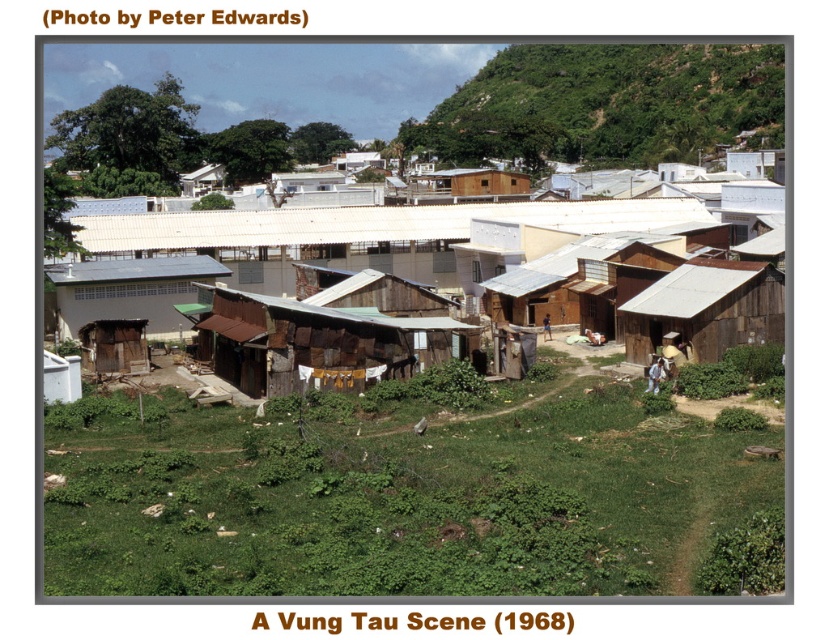
Does weathered wood hut at center-right appear on the right side of brown corrugated metal hut at lower left?

Indeed, weathered wood hut at center-right is positioned on the right side of brown corrugated metal hut at lower left.

Who is more distant from viewer, (x=728, y=332) or (x=206, y=260)?

The point (x=206, y=260) is more distant.

You are a GUI agent. You are given a task and a screenshot of the screen. Output one action in this format:
    pyautogui.click(x=<x>, y=<y>)
    Task: Click on the weathered wood hut at center-right
    The height and width of the screenshot is (640, 829).
    Given the screenshot: What is the action you would take?
    pyautogui.click(x=704, y=308)

Is green leafy hillside at upper right thinner than weathered wood hut at center-right?

No.

Is green leafy hillside at upper right wider than weathered wood hut at center-right?

Yes.

I want to click on green leafy hillside at upper right, so click(x=604, y=104).

Which is below, green leafy hillside at upper right or brown corrugated metal hut at lower left?

Positioned lower is brown corrugated metal hut at lower left.

At what (x,y) coordinates should I click in order to perform the action: click on green leafy hillside at upper right. Please return your answer as a coordinate pair (x, y). Looking at the image, I should click on (604, 104).

The image size is (829, 640). What are the coordinates of `green leafy hillside at upper right` in the screenshot? It's located at (604, 104).